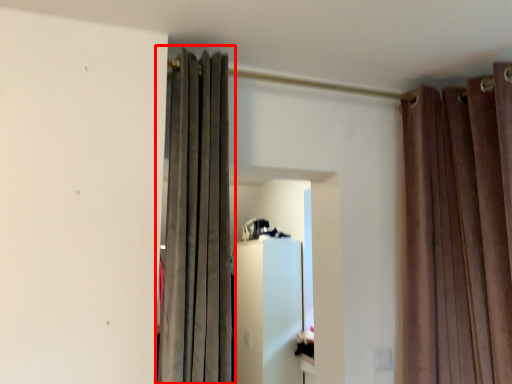
Question: In this image, where is curtain (annotated by the red box) located relative to curtain?

Choices:
 (A) right
 (B) left

Answer: (B)